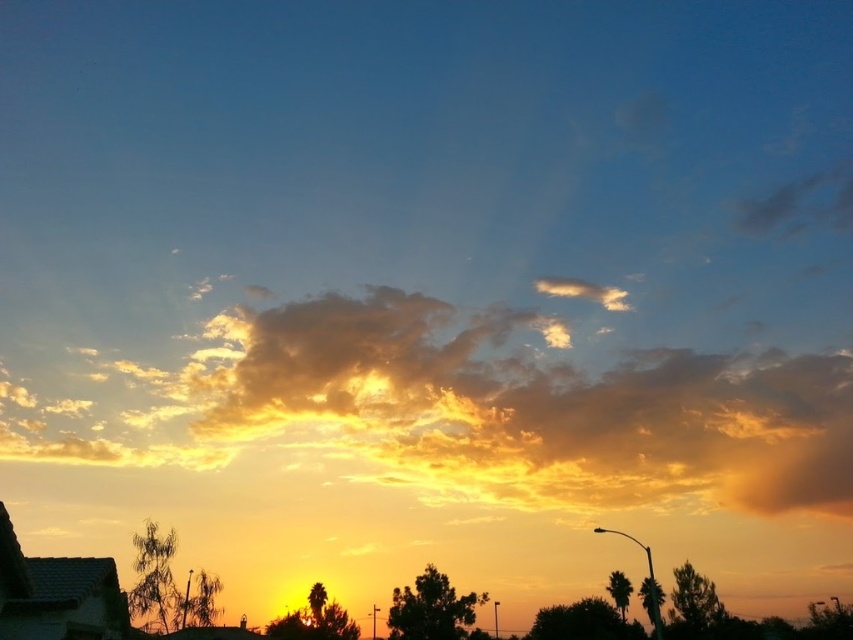
You are an artist trying to paint the sunset scene. You notice two clouds in the sky. The golden fluffy cloud at center and the cloudy cotton cloud at upper center. Which cloud is positioned lower in the sky?

The golden fluffy cloud at center is positioned lower in the sky than the cloudy cotton cloud at upper center.

You are an artist trying to paint the sunset scene. You notice two clouds in the sky. The golden fluffy cloud at center and the cloudy cotton cloud at upper center. Which cloud should you paint first if you want to depict the larger one before the smaller one?

You should paint the golden fluffy cloud at center first because it is larger in size than the cloudy cotton cloud at upper center.